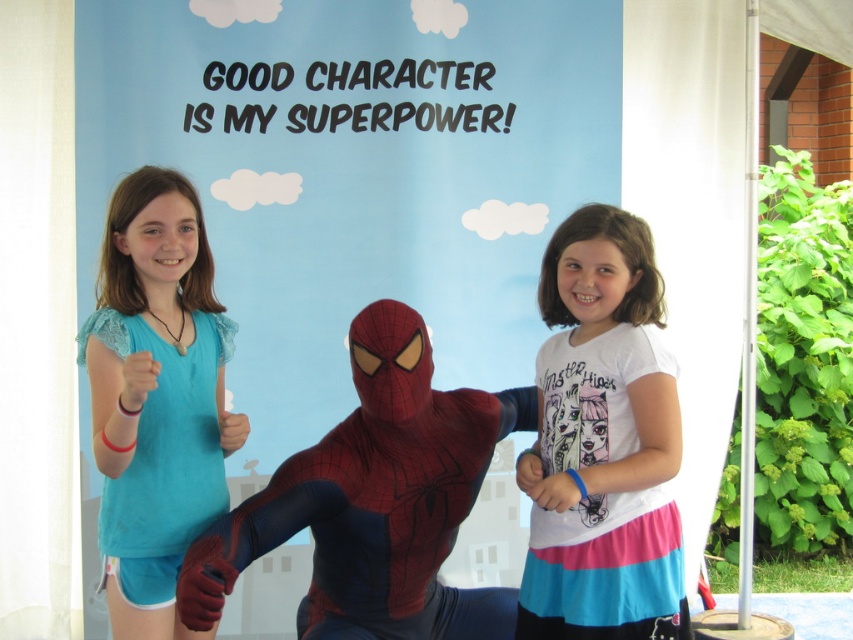
Looking at this image, based on the scene description, which object is shorter in height between the shiny spandex suit at center and the matte blue shirt at left?

The shiny spandex suit at center is shorter than the matte blue shirt at left.

You are standing in front of the backdrop with the text and want to place two stickers at the specified coordinates. The first sticker is at point (287, 8) and the second at point (582, 433). Which sticker will be closer to the front of the backdrop?

Point (582, 433) is closer to the front of the backdrop because the description states that point (287, 8) is behind point (582, 433).

Looking at the scene with the backdrop showing the text about good character, there are two girls and two items at the center. The items are the blue paper at center and the white cotton shirt at center. Which item is positioned more to the left?

The blue paper at center is positioned to the left of the white cotton shirt at center.